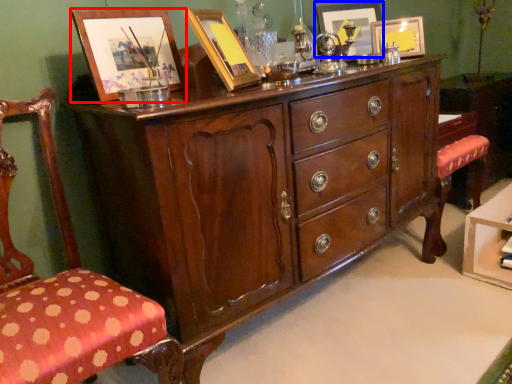
Question: Among these objects, which one is farthest to the camera, picture frame (highlighted by a red box) or picture frame (highlighted by a blue box)?

Choices:
 (A) picture frame
 (B) picture frame

Answer: (B)